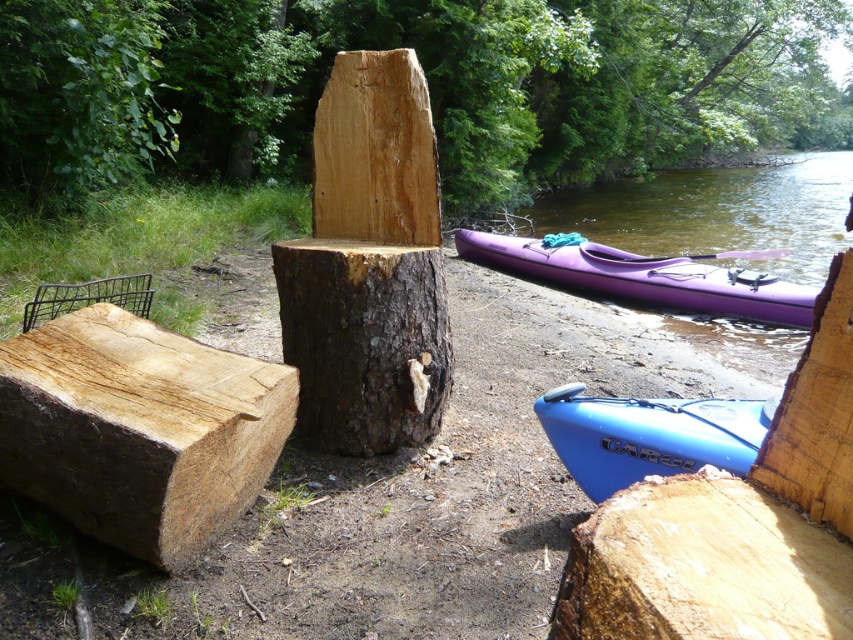
You are standing at the riverside and want to reach a specific point marked as point [730,580]. If your maximum comfortable reach is 1 meter, can you comfortably reach that point without moving closer?

The distance of point [730,580] from the viewer is 1.08 meters, so it is slightly beyond your maximum comfortable reach of 1 meter. You would need to move closer to comfortably reach it.